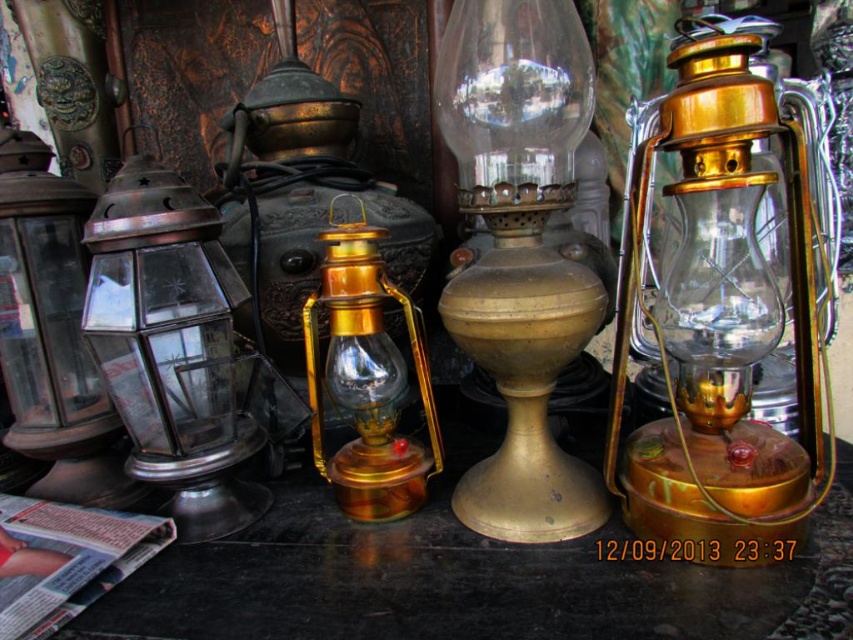
Does polished brass lantern at left have a larger size compared to matte glass lantern at left?

Correct, polished brass lantern at left is larger in size than matte glass lantern at left.

Which is in front, point (222, 330) or point (64, 333)?

Point (222, 330)

Find the location of a particular element. The image size is (853, 640). polished brass lantern at left is located at coordinates (172, 348).

Between shiny black table at center and gold polished metal lantern at center, which one appears on the right side from the viewer's perspective?

From the viewer's perspective, gold polished metal lantern at center appears more on the right side.

Which is in front, point (445, 413) or point (738, 36)?

Point (738, 36) is more forward.

Identify the location of shiny black table at center. The height and width of the screenshot is (640, 853). (466, 577).

Who is positioned more to the right, gold polished metal lantern at center or matte glass lantern at left?

gold polished metal lantern at center

Image resolution: width=853 pixels, height=640 pixels. Describe the element at coordinates (718, 323) in the screenshot. I see `gold polished metal lantern at center` at that location.

Who is more forward, (804,369) or (73,452)?

Point (804,369)

This screenshot has height=640, width=853. Find the location of `gold polished metal lantern at center`. gold polished metal lantern at center is located at coordinates (718, 323).